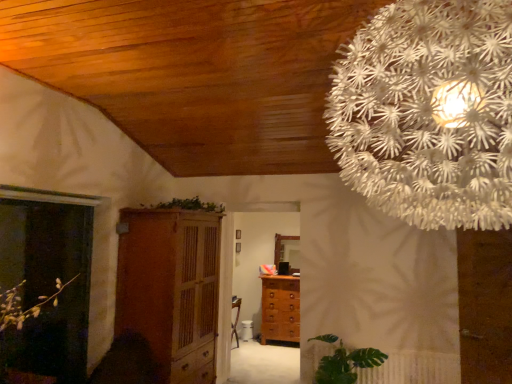
Question: Is translucent glass screen door at left completely or partially outside of wooden cabinet at center?

Choices:
 (A) no
 (B) yes

Answer: (B)

Question: Is translucent glass screen door at left positioned in front of wooden cabinet at center?

Choices:
 (A) yes
 (B) no

Answer: (A)

Question: Is translucent glass screen door at left positioned behind wooden cabinet at center?

Choices:
 (A) no
 (B) yes

Answer: (A)

Question: From the image's perspective, does translucent glass screen door at left appear lower than wooden cabinet at center?

Choices:
 (A) yes
 (B) no

Answer: (B)

Question: From a real-world perspective, is translucent glass screen door at left located higher than wooden cabinet at center?

Choices:
 (A) no
 (B) yes

Answer: (B)

Question: Does point (202, 296) appear closer or farther from the camera than point (442, 152)?

Choices:
 (A) farther
 (B) closer

Answer: (A)

Question: Is wooden cabinet at center to the left or to the right of white paper flower at upper right in the image?

Choices:
 (A) right
 (B) left

Answer: (B)

Question: Is wooden cabinet at center bigger or smaller than white paper flower at upper right?

Choices:
 (A) big
 (B) small

Answer: (A)

Question: Is wooden cabinet at center wider or thinner than white paper flower at upper right?

Choices:
 (A) wide
 (B) thin

Answer: (B)

Question: In terms of height, does green leafy plant at lower right look taller or shorter compared to green leafy plant at upper center?

Choices:
 (A) tall
 (B) short

Answer: (A)

Question: From a real-world perspective, is green leafy plant at lower right physically located above or below green leafy plant at upper center?

Choices:
 (A) above
 (B) below

Answer: (B)

Question: Would you say green leafy plant at lower right is inside or outside green leafy plant at upper center?

Choices:
 (A) inside
 (B) outside

Answer: (B)

Question: From the image's perspective, is green leafy plant at lower right positioned above or below green leafy plant at upper center?

Choices:
 (A) below
 (B) above

Answer: (A)

Question: Relative to brown wooden chest of drawers at center, is white paper flower at upper right in front or behind?

Choices:
 (A) behind
 (B) front

Answer: (B)

Question: From their relative heights in the image, would you say white paper flower at upper right is taller or shorter than brown wooden chest of drawers at center?

Choices:
 (A) tall
 (B) short

Answer: (A)